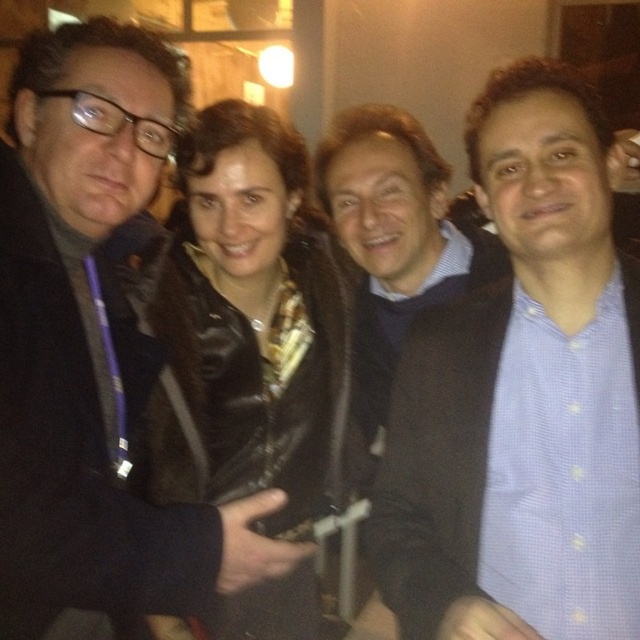
Question: Can you confirm if blue checkered shirt at center is positioned above black leather jacket at center?

Choices:
 (A) yes
 (B) no

Answer: (A)

Question: Which point is closer to the camera?

Choices:
 (A) (228, 381)
 (B) (547, 346)

Answer: (B)

Question: Which object is positioned closest to the blue checkered shirt at center?

Choices:
 (A) black leather jacket at center
 (B) matte black coat at left

Answer: (B)

Question: Which object is positioned farthest from the matte black coat at left?

Choices:
 (A) blue checkered shirt at center
 (B) black leather jacket at center

Answer: (A)

Question: Does matte black coat at left have a lesser width compared to black leather jacket at center?

Choices:
 (A) yes
 (B) no

Answer: (A)

Question: Does blue checkered shirt at center have a greater width compared to matte black coat at left?

Choices:
 (A) no
 (B) yes

Answer: (A)